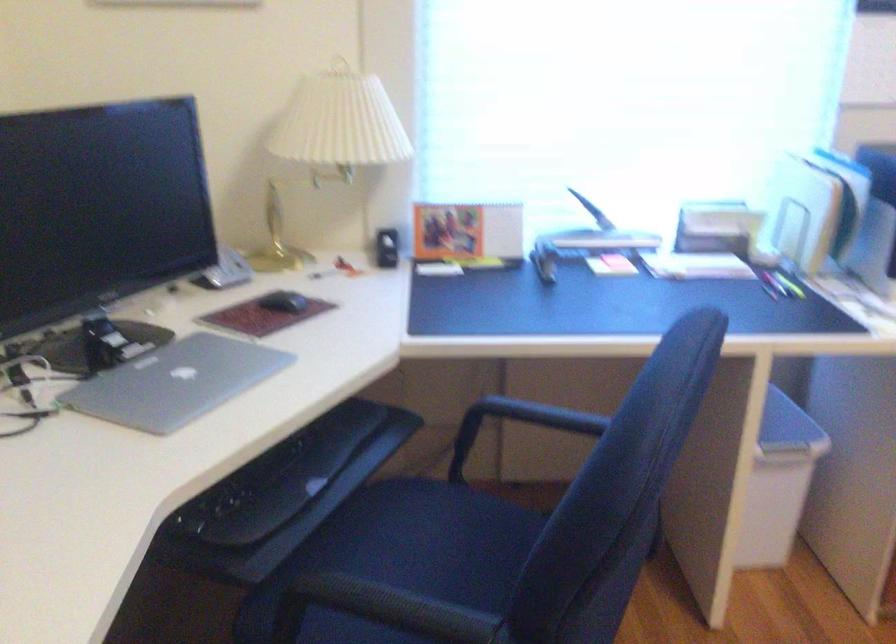
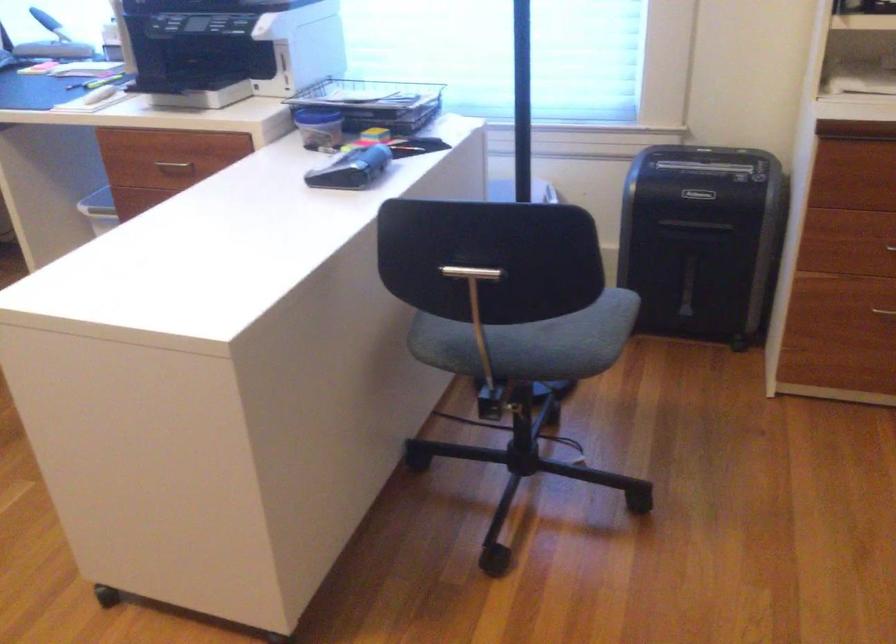
Question: The images are taken continuously from a first-person perspective. In which direction are you moving?

Choices:
 (A) Left
 (B) Right
 (C) Forward
 (D) Backward

Answer: (B)